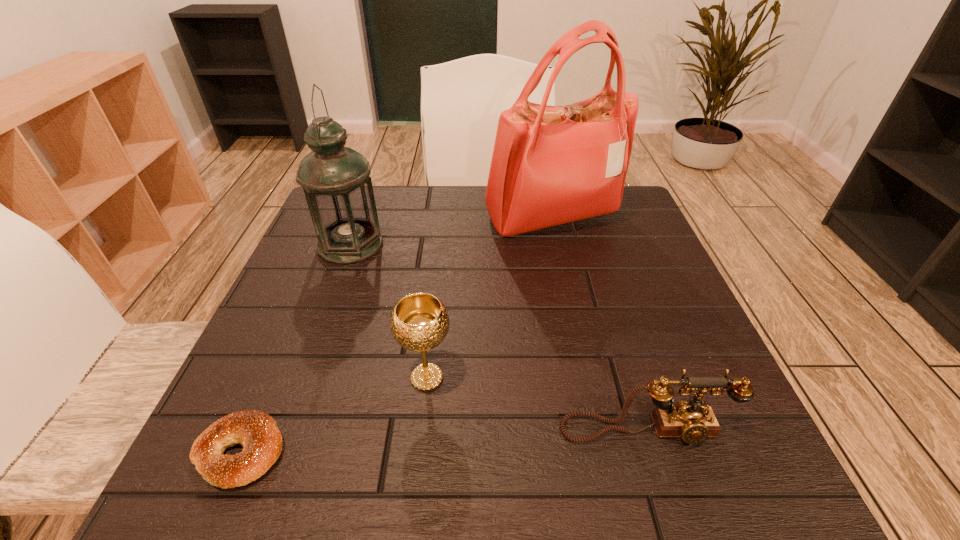
Where is `free space located on the back of the bagel`? The height and width of the screenshot is (540, 960). free space located on the back of the bagel is located at coordinates (289, 338).

The image size is (960, 540). What are the coordinates of `handbag located at the far edge` in the screenshot? It's located at (551, 165).

I want to click on oil lamp present at the far edge, so click(336, 181).

I want to click on telephone located in the near edge section of the desktop, so click(x=693, y=422).

At what (x,y) coordinates should I click in order to perform the action: click on bagel that is at the near edge. Please return your answer as a coordinate pair (x, y). Image resolution: width=960 pixels, height=540 pixels. Looking at the image, I should click on (257, 432).

Locate an element on the screen. Image resolution: width=960 pixels, height=540 pixels. oil lamp located in the left edge section of the desktop is located at coordinates (336, 181).

What are the coordinates of `bagel present at the left edge` in the screenshot? It's located at (257, 432).

You are a GUI agent. You are given a task and a screenshot of the screen. Output one action in this format:
    pyautogui.click(x=<x>, y=<y>)
    Task: Click on the handbag that is at the right edge
    This screenshot has width=960, height=540.
    Given the screenshot: What is the action you would take?
    pyautogui.click(x=551, y=165)

This screenshot has height=540, width=960. What are the coordinates of `telephone that is at the right edge` in the screenshot? It's located at (693, 422).

Locate an element on the screen. The image size is (960, 540). object located in the far left corner section of the desktop is located at coordinates (336, 181).